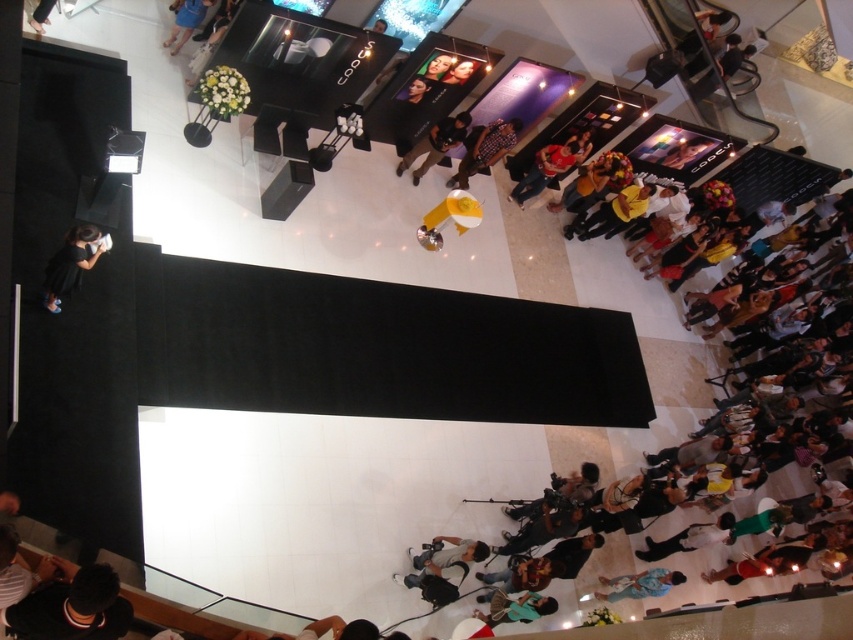
You are organizing a photo shoot and need to ensure that all items are visible in the frame. Given the scene described, which item, the black fuzzy hat at lower left or the black matte dress at lower left, might require more space horizontally to fit into the camera frame?

The black fuzzy hat at lower left might be wider than the black matte dress at lower left, so it might require more horizontal space to fit into the camera frame.

You are standing at the position of the viewer in the scene. There is a black fuzzy hat at lower left. Can you reach it without moving your feet?

The black fuzzy hat at lower left is 4.45 meters away from the viewer, so you cannot reach it without moving your feet.